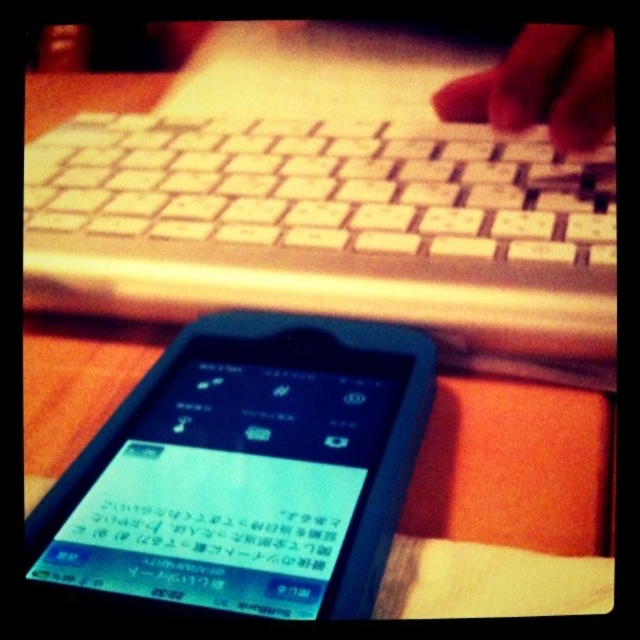
You are setting up a workspace and want to place both the blue plastic phone at lower center and the smooth skin hand at upper right on the desk. Based on their sizes, which object should you allocate more desk space for?

The smooth skin hand at upper right requires more desk space because it is taller than the blue plastic phone at lower center.

You are a delivery robot that needs to place a small package between the black matte smartphone at lower center and the smooth skin hand at upper right. The package requires a minimum space of 30 centimeters. Can you fit it there?

The black matte smartphone at lower center and smooth skin hand at upper right are 31.86 centimeters apart from each other, so yes, the package can fit between them since the required space is 30 centimeters.

You are organizing a workspace and need to move items from front to back. You have the white plastic keyboard at upper center and the smooth skin hand at upper right. Which object should you move first to make space?

The white plastic keyboard at upper center is in front of the smooth skin hand at upper right, so you should move the white plastic keyboard at upper center first to make space.